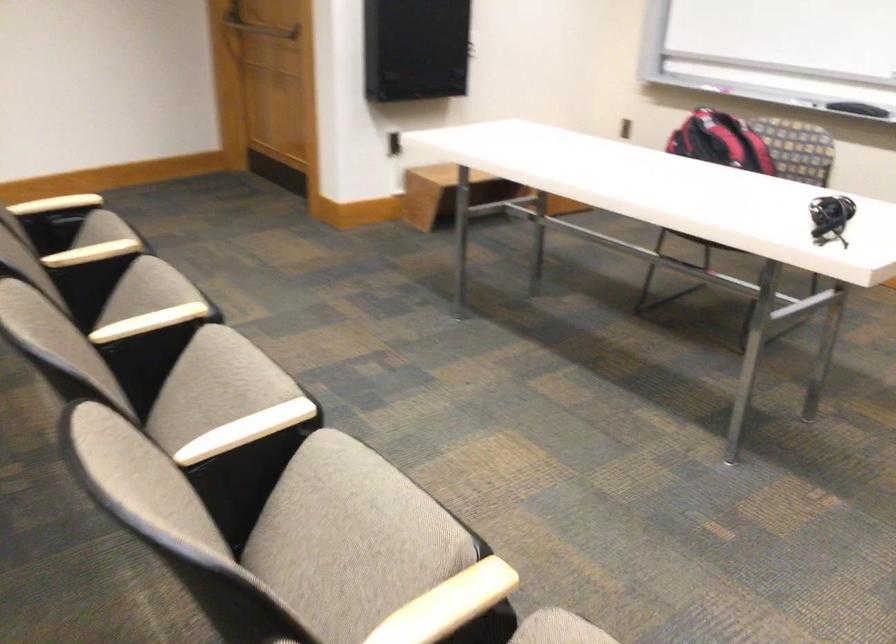
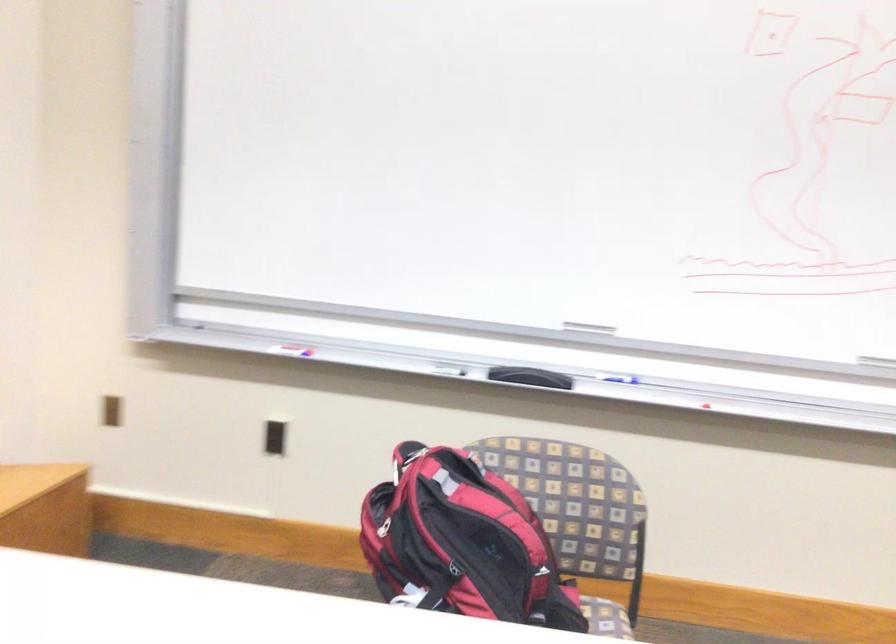
Find the pixel in the second image that matches the point at 635,109 in the first image.

(112, 410)